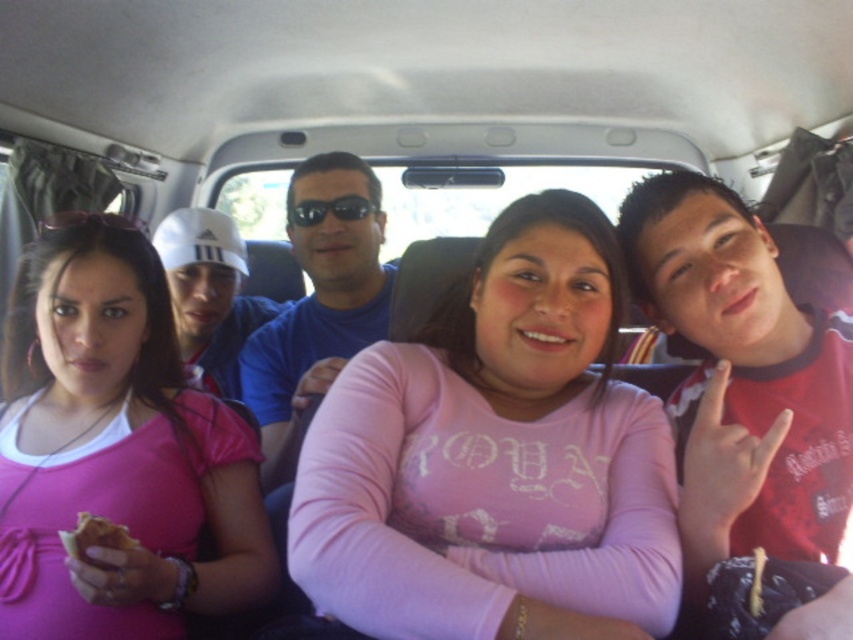
Between red cotton shirt at right and golden crispy bread at lower left, which one is positioned higher?

red cotton shirt at right is above.

Does point (734, 243) lie in front of point (122, 536)?

No, it is not.

Is point (693, 508) positioned before point (97, 561)?

Yes, it is.

The height and width of the screenshot is (640, 853). Find the location of `red cotton shirt at right`. red cotton shirt at right is located at coordinates (741, 380).

Does pink matte shirt at center have a smaller size compared to blue t-shirt at center?

Yes, pink matte shirt at center is smaller than blue t-shirt at center.

Which is in front, point (326, 397) or point (312, 157)?

Point (326, 397) is in front.

Locate an element on the screen. Image resolution: width=853 pixels, height=640 pixels. pink matte shirt at center is located at coordinates (496, 458).

Can you confirm if pink matte shirt at center is wider than black plastic sunglasses at center?

Yes.

Who is taller, pink matte shirt at center or black plastic sunglasses at center?

pink matte shirt at center

Which is behind, point (608, 627) or point (364, 202)?

The point (364, 202) is behind.

I want to click on pink matte shirt at center, so click(x=496, y=458).